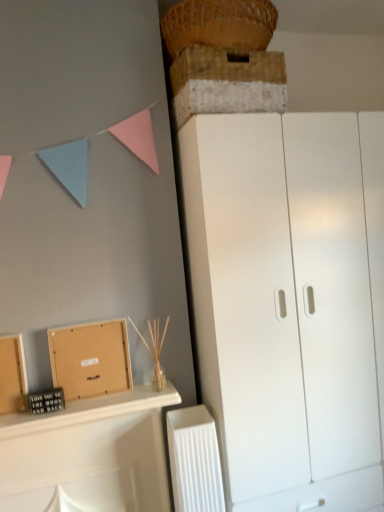
From the picture: What is the approximate height of rustic wooden crate at upper center?

The height of rustic wooden crate at upper center is 8.63 inches.

The image size is (384, 512). What do you see at coordinates (90, 359) in the screenshot?
I see `brown cardboard box at lower left` at bounding box center [90, 359].

The width and height of the screenshot is (384, 512). I want to click on white matte cupboard at right, so click(289, 302).

The width and height of the screenshot is (384, 512). What do you see at coordinates (194, 460) in the screenshot?
I see `white plastic radiator at lower center` at bounding box center [194, 460].

Identify the location of wooden at left. The image size is (384, 512). (89, 451).

Based on the photo, is white matte cupboard at right outside of white plastic radiator at lower center?

white matte cupboard at right lies outside white plastic radiator at lower center's area.

Considering the sizes of objects white matte cupboard at right and white plastic radiator at lower center in the image provided, who is taller, white matte cupboard at right or white plastic radiator at lower center?

white matte cupboard at right is taller.

Which object is closer to the camera taking this photo, white matte cupboard at right or white plastic radiator at lower center?

white matte cupboard at right.

In terms of size, does white matte cupboard at right appear bigger or smaller than white plastic radiator at lower center?

In the image, white matte cupboard at right appears to be larger than white plastic radiator at lower center.

Is rustic wooden crate at upper center positioned far away from white matte cupboard at right?

No.

Is the depth of rustic wooden crate at upper center greater than that of white matte cupboard at right?

No, rustic wooden crate at upper center is closer to the camera.

Looking at this image, is rustic wooden crate at upper center wider than white matte cupboard at right?

In fact, rustic wooden crate at upper center might be narrower than white matte cupboard at right.

From a real-world perspective, between rustic wooden crate at upper center and white matte cupboard at right, who is vertically higher?

rustic wooden crate at upper center, from a real-world perspective.

Based on their sizes in the image, would you say white plastic radiator at lower center is bigger or smaller than rustic wooden crate at upper center?

white plastic radiator at lower center is smaller than rustic wooden crate at upper center.

From a real-world perspective, between white plastic radiator at lower center and rustic wooden crate at upper center, who is vertically lower?

white plastic radiator at lower center.

Can you confirm if white plastic radiator at lower center is positioned to the right of rustic wooden crate at upper center?

No.

Relative to woven straw basket at upper center, is wooden at left in front or behind?

In the image, wooden at left appears in front of woven straw basket at upper center.

Which is correct: wooden at left is inside woven straw basket at upper center, or outside of it?

wooden at left is spatially situated outside woven straw basket at upper center.

Which is in front, point (154, 508) or point (191, 16)?

The point (191, 16) is in front.

From the image's perspective, does wooden at left appear lower than woven straw basket at upper center?

Yes, from the image's perspective, wooden at left is beneath woven straw basket at upper center.

Image resolution: width=384 pixels, height=512 pixels. I want to click on shelf lying on the left of white matte cupboard at right, so click(x=89, y=451).

Can we say wooden at left lies outside white matte cupboard at right?

wooden at left lies outside white matte cupboard at right's area.

How distant is wooden at left from white matte cupboard at right?

They are 54.63 centimeters apart.

Is wooden at left oriented away from white matte cupboard at right?

No, white matte cupboard at right is not at the back of wooden at left.

Is brown cardboard box at lower left positioned before woven straw basket at upper center?

No, it is not.

In the scene shown: Considering the sizes of brown cardboard box at lower left and woven straw basket at upper center in the image, is brown cardboard box at lower left taller or shorter than woven straw basket at upper center?

brown cardboard box at lower left is taller than woven straw basket at upper center.

Which of these two, brown cardboard box at lower left or woven straw basket at upper center, is thinner?

With smaller width is brown cardboard box at lower left.

Does point (63, 371) come farther from viewer compared to point (209, 22)?

Yes, it is.

Consider the image. Can you confirm if rustic wooden crate at upper center is positioned to the right of wooden at left?

Correct, you'll find rustic wooden crate at upper center to the right of wooden at left.

Is point (214, 48) farther from camera compared to point (157, 445)?

That is False.

Would you say rustic wooden crate at upper center contains wooden at left?

No.

Does rustic wooden crate at upper center have a greater width compared to wooden at left?

No, rustic wooden crate at upper center is not wider than wooden at left.

Find the location of a particular element. radiator that appears on the left of white matte cupboard at right is located at coordinates (194, 460).

Locate an element on the screen. cabinetry that is above the white matte cupboard at right (from the image's perspective) is located at coordinates (227, 82).

Looking at this image, which object lies further to the anchor point white matte cupboard at right, wooden at left or brown cardboard box at lower left?

brown cardboard box at lower left is further to white matte cupboard at right.

From the image, which object appears to be farther from rustic wooden crate at upper center, white matte cupboard at right or wooden at left?

wooden at left lies further to rustic wooden crate at upper center than the other object.

From the image, which object appears to be farther from rustic wooden crate at upper center, brown cardboard box at lower left or wooden at left?

Based on the image, wooden at left appears to be further to rustic wooden crate at upper center.

Considering their positions, is wooden at left positioned closer to rustic wooden crate at upper center than white plastic radiator at lower center?

wooden at left is positioned closer to the anchor rustic wooden crate at upper center.

Estimate the real-world distances between objects in this image. Which object is closer to wooden at left, brown cardboard box at lower left or white plastic radiator at lower center?

brown cardboard box at lower left lies closer to wooden at left than the other object.

Which object lies nearer to the anchor point woven straw basket at upper center, brown cardboard box at lower left or white plastic radiator at lower center?

brown cardboard box at lower left is positioned closer to the anchor woven straw basket at upper center.

In the scene shown: Which object lies further to the anchor point woven straw basket at upper center, rustic wooden crate at upper center or brown cardboard box at lower left?

Based on the image, brown cardboard box at lower left appears to be further to woven straw basket at upper center.

Based on their spatial positions, is rustic wooden crate at upper center or white matte cupboard at right closer to wooden at left?

white matte cupboard at right.

Where is `cabinetry between woven straw basket at upper center and white plastic radiator at lower center in the vertical direction`? The height and width of the screenshot is (512, 384). cabinetry between woven straw basket at upper center and white plastic radiator at lower center in the vertical direction is located at coordinates (227, 82).

Where is `radiator between brown cardboard box at lower left and white matte cupboard at right`? radiator between brown cardboard box at lower left and white matte cupboard at right is located at coordinates (194, 460).

Identify the location of cardboard box between woven straw basket at upper center and white matte cupboard at right in the up-down direction. The height and width of the screenshot is (512, 384). pyautogui.click(x=90, y=359).

Where is `cupboard between rustic wooden crate at upper center and white plastic radiator at lower center in the up-down direction`? The image size is (384, 512). cupboard between rustic wooden crate at upper center and white plastic radiator at lower center in the up-down direction is located at coordinates (289, 302).